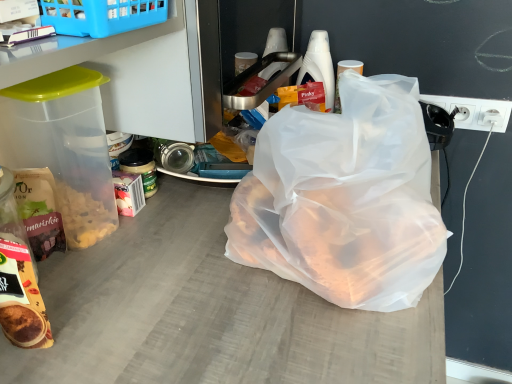
Question: Considering the positions of white plastic bottle at upper right and white plastic socket at right in the image, is white plastic bottle at upper right bigger or smaller than white plastic socket at right?

Choices:
 (A) small
 (B) big

Answer: (B)

Question: Visually, is white plastic bottle at upper right positioned to the left or to the right of white plastic socket at right?

Choices:
 (A) left
 (B) right

Answer: (A)

Question: Which of these objects is positioned closest to the transparent plastic bag at center?

Choices:
 (A) matte brown bag of cereal at left
 (B) white plastic socket at right
 (C) white plastic bottle at upper right
 (D) matte brown snack bag at lower left

Answer: (D)

Question: Which is farther from the matte brown snack bag at lower left?

Choices:
 (A) matte brown bag of cereal at left
 (B) white plastic bottle at upper right
 (C) white plastic socket at right
 (D) transparent plastic bag at center

Answer: (C)